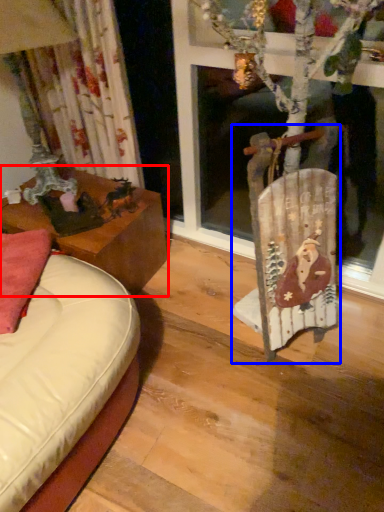
Question: Which object is further to the camera taking this photo, table (highlighted by a red box) or chair (highlighted by a blue box)?

Choices:
 (A) table
 (B) chair

Answer: (A)